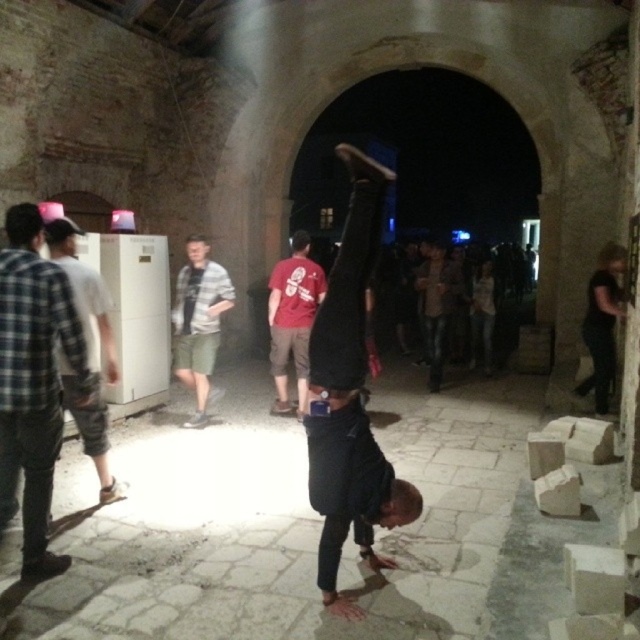
You are an interior designer assessing the layout of this indoor space. You notice the black matte pants at center and the plaid fabric shirt at left. Which object is positioned closer to the light source coming from the left side of the image?

The plaid fabric shirt at left is closer to the light source since it is positioned to the left side of the image, where the light originates. The black matte pants at center is to the right of it, meaning it is farther from the light source.

Looking at this image, you are standing in the indoor setting and want to move from the black matte pants at center to the brown leather jacket at center. Which direction should you move to reach it?

The black matte pants at center is to the left of brown leather jacket at center, so you should move to the right to reach the brown leather jacket at center.